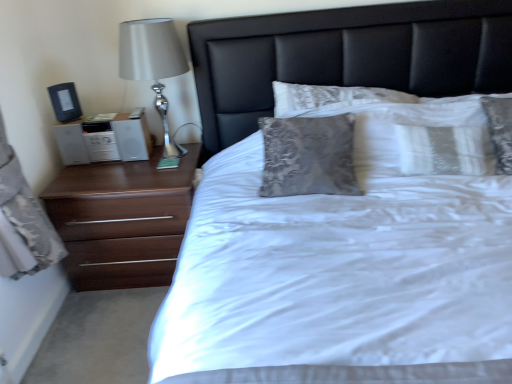
Question: Is brown wood chest of drawers at left wider than white glossy nightstand at left?

Choices:
 (A) yes
 (B) no

Answer: (A)

Question: Is the depth of brown wood chest of drawers at left greater than that of white glossy nightstand at left?

Choices:
 (A) no
 (B) yes

Answer: (A)

Question: Does brown wood chest of drawers at left appear on the right side of white glossy nightstand at left?

Choices:
 (A) yes
 (B) no

Answer: (A)

Question: Is brown wood chest of drawers at left taller than white glossy nightstand at left?

Choices:
 (A) yes
 (B) no

Answer: (A)

Question: From a real-world perspective, is brown wood chest of drawers at left positioned under white glossy nightstand at left based on gravity?

Choices:
 (A) yes
 (B) no

Answer: (A)

Question: Considering the relative sizes of brown wood chest of drawers at left and white glossy nightstand at left in the image provided, is brown wood chest of drawers at left thinner than white glossy nightstand at left?

Choices:
 (A) yes
 (B) no

Answer: (B)

Question: Is black leather headboard at center smaller than brown wood chest of drawers at left?

Choices:
 (A) yes
 (B) no

Answer: (B)

Question: Is black leather headboard at center at the left side of brown wood chest of drawers at left?

Choices:
 (A) no
 (B) yes

Answer: (A)

Question: From a real-world perspective, is black leather headboard at center physically above brown wood chest of drawers at left?

Choices:
 (A) no
 (B) yes

Answer: (B)

Question: Can you confirm if black leather headboard at center is wider than brown wood chest of drawers at left?

Choices:
 (A) yes
 (B) no

Answer: (B)

Question: From the image's perspective, is black leather headboard at center under brown wood chest of drawers at left?

Choices:
 (A) yes
 (B) no

Answer: (B)

Question: Is black leather headboard at center closer to the viewer compared to brown wood chest of drawers at left?

Choices:
 (A) yes
 (B) no

Answer: (A)

Question: From a real-world perspective, is black leather headboard at center below white satin bed at center?

Choices:
 (A) yes
 (B) no

Answer: (B)